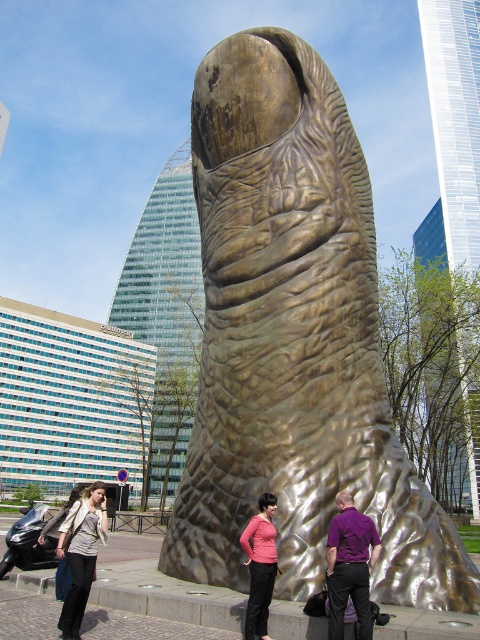
Question: Does gold textured finger at center have a lesser width compared to purple matte shirt at center?

Choices:
 (A) no
 (B) yes

Answer: (A)

Question: Is gold textured finger at center below purple matte shirt at center?

Choices:
 (A) yes
 (B) no

Answer: (B)

Question: Which point appears closest to the camera in this image?

Choices:
 (A) (93, 552)
 (B) (466, 566)
 (C) (349, 577)

Answer: (C)

Question: Which object is closer to the camera taking this photo?

Choices:
 (A) gold textured finger at center
 (B) pink matte shirt at center

Answer: (B)

Question: Does gold textured finger at center come in front of purple matte shirt at center?

Choices:
 (A) yes
 (B) no

Answer: (B)

Question: Which object is closer to the camera taking this photo?

Choices:
 (A) purple matte shirt at center
 (B) gold textured finger at center
 (C) matte gray jacket at lower left
 (D) pink matte shirt at center

Answer: (A)